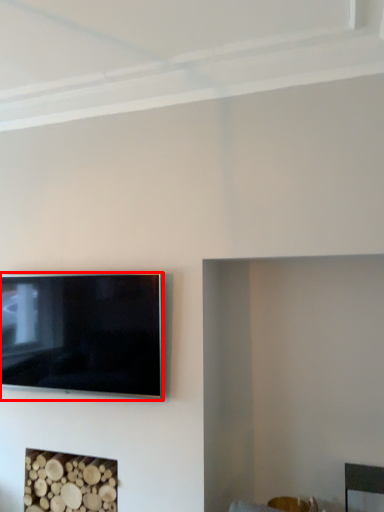
Question: Where is television (annotated by the red box) located in relation to fireplace in the image?

Choices:
 (A) left
 (B) right

Answer: (A)